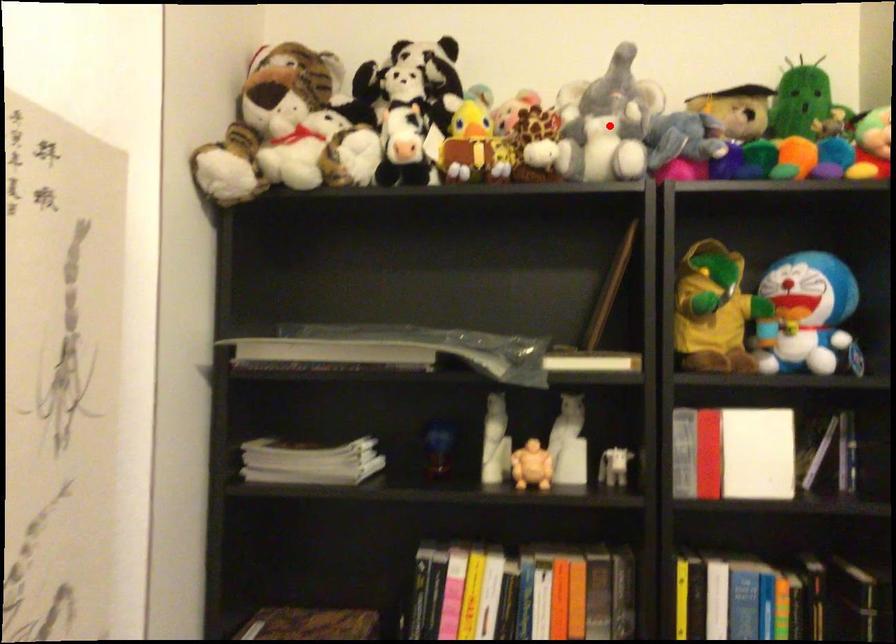
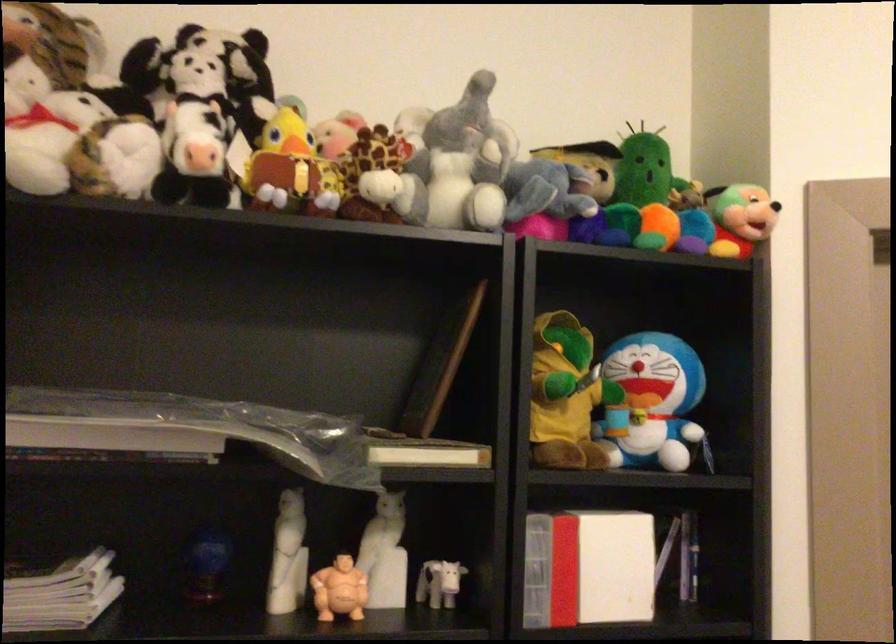
Locate, in the second image, the point that corresponds to the highlighted location in the first image.

(459, 165)